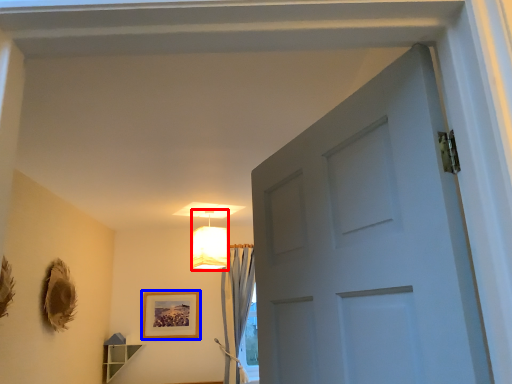
Question: Which object appears farthest to the camera in this image, lamp (highlighted by a red box) or picture frame (highlighted by a blue box)?

Choices:
 (A) lamp
 (B) picture frame

Answer: (B)